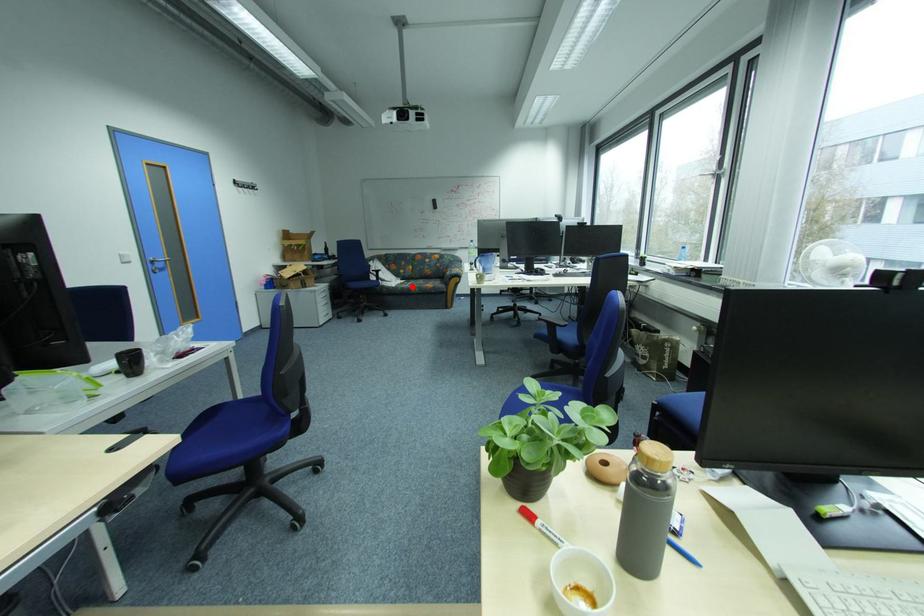
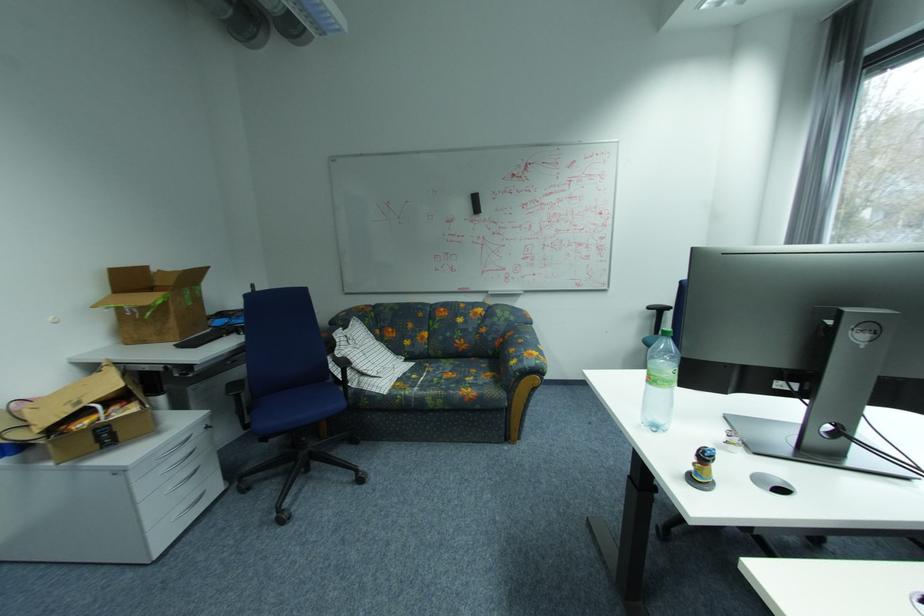
Find the pixel in the second image that matches the highlighted location in the first image.

(416, 392)